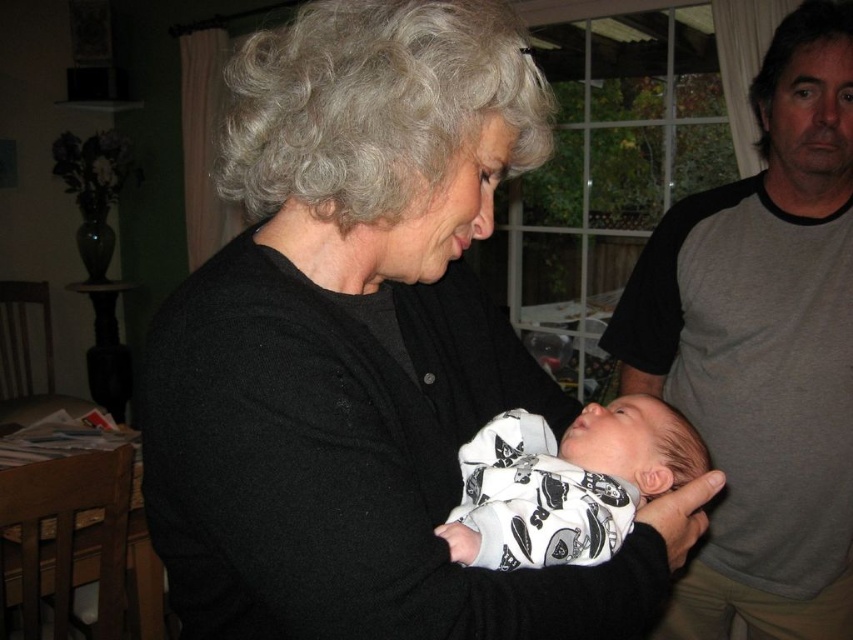
Question: Which of the following is the closest to the observer?

Choices:
 (A) black soft sweater at center
 (B) gray cotton t-shirt at upper right

Answer: (A)

Question: Can you confirm if black soft sweater at center is smaller than gray cotton t-shirt at upper right?

Choices:
 (A) no
 (B) yes

Answer: (B)

Question: From the image, what is the correct spatial relationship of gray cotton t-shirt at upper right in relation to white cotton swaddle at center?

Choices:
 (A) above
 (B) below

Answer: (A)

Question: In this image, where is black soft sweater at center located relative to gray cotton t-shirt at upper right?

Choices:
 (A) below
 (B) above

Answer: (B)

Question: Which point is closer to the camera taking this photo?

Choices:
 (A) (456, 580)
 (B) (663, 460)
 (C) (775, 275)

Answer: (A)

Question: Which of the following is the farthest from the observer?

Choices:
 (A) white cotton swaddle at center
 (B) gray cotton t-shirt at upper right

Answer: (B)